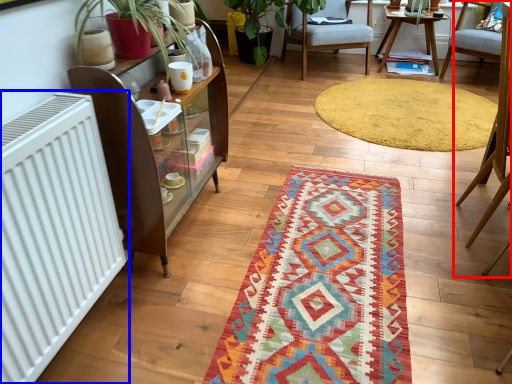
Question: Which of the following is the farthest to the observer, chair (highlighted by a red box) or radiator (highlighted by a blue box)?

Choices:
 (A) chair
 (B) radiator

Answer: (A)